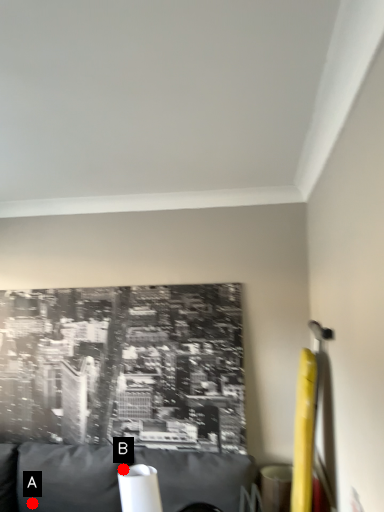
Question: Two points are circled on the image, labeled by A and B beside each circle. Which point is closer to the camera?

Choices:
 (A) A is closer
 (B) B is closer

Answer: (B)